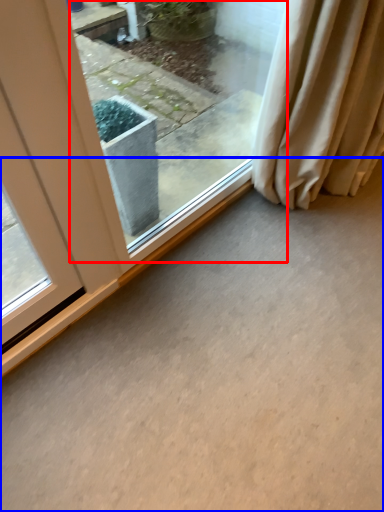
Question: Which of the following is the farthest to the observer, window (highlighted by a red box) or concrete (highlighted by a blue box)?

Choices:
 (A) window
 (B) concrete

Answer: (A)